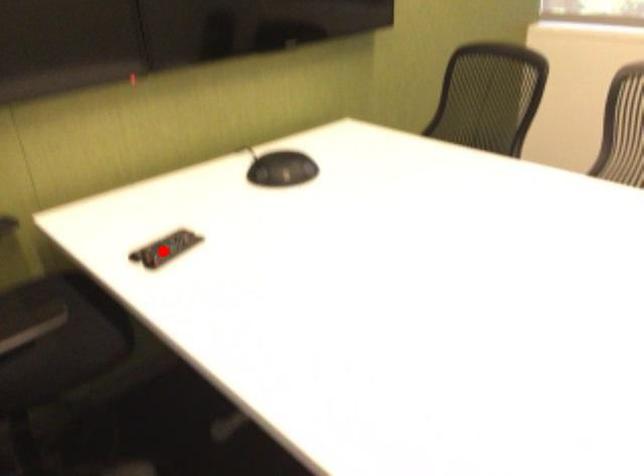
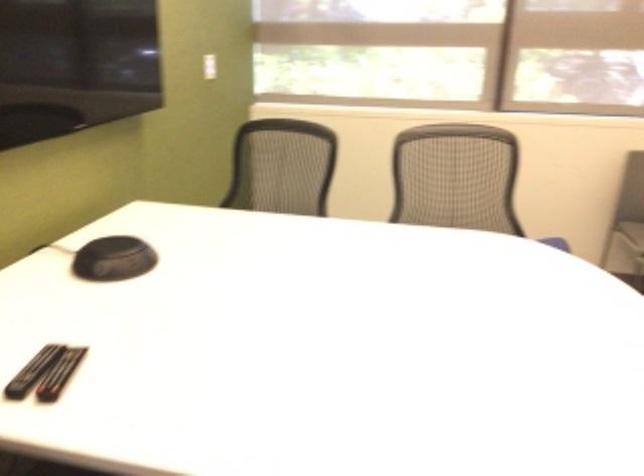
In the second image, find the point that corresponds to the highlighted location in the first image.

(59, 374)